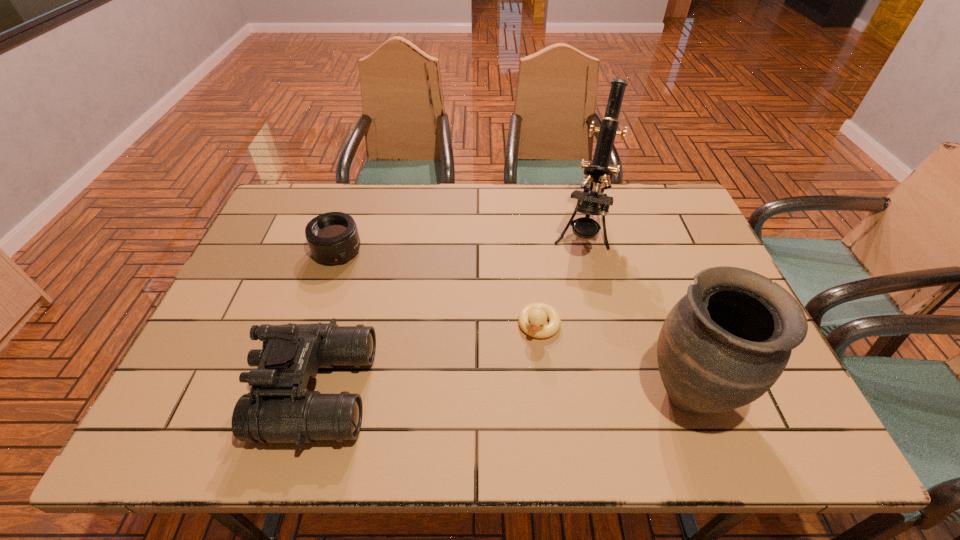
In order to click on vacant space on the desktop that is between the third tallest object and the urn and is positioned through the eyepiece of the microscope in this screenshot , I will do `click(539, 392)`.

At what (x,y) coordinates should I click in order to perform the action: click on free spot on the desktop that is between the binoculars and the urn and is positioned on the side of the telephoto lens with brand markings and control switches. Please return your answer as a coordinate pair (x, y). The width and height of the screenshot is (960, 540). Looking at the image, I should click on (472, 392).

You are a GUI agent. You are given a task and a screenshot of the screen. Output one action in this format:
    pyautogui.click(x=<x>, y=<y>)
    Task: Click on the free space on the desktop that is between the third tallest object and the second tallest object and is positioned at the beak of the third object from right to left
    
    Given the screenshot: What is the action you would take?
    pyautogui.click(x=513, y=392)